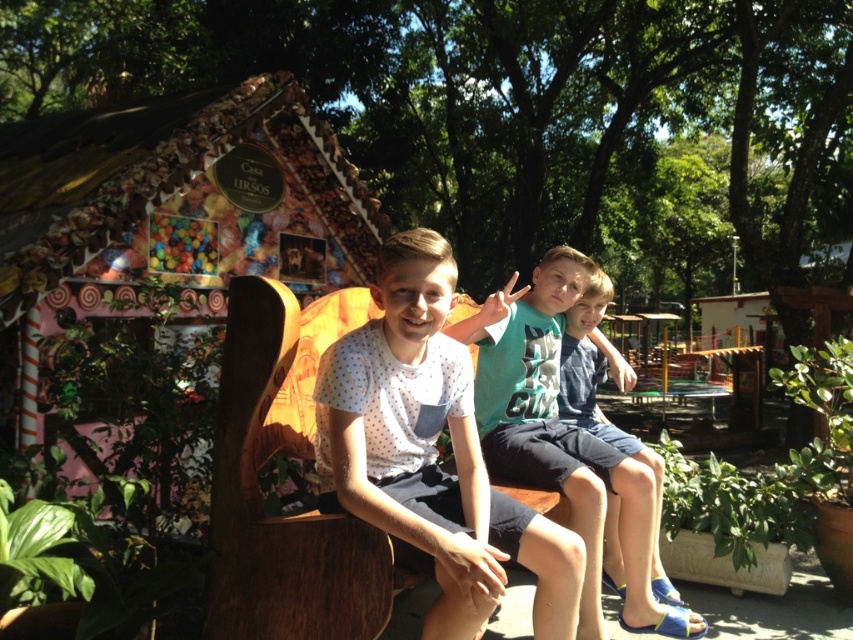
You are a photographer trying to capture a candid shot of the children. You want to ensure the white dotted shirt at center and the blue denim shorts at center are both in focus. Since the camera can only focus on one subject at a time, which one should you choose to ensure both are sharp?

The white dotted shirt at center is to the left of blue denim shorts at center, so focusing on the white dotted shirt at center will ensure both are in focus as they are positioned closely together.

You are standing in the park and see two points marked in the image. The first point is at coordinates point (457, 465) and the second is at point (682, 632). Which point is closer to your current position?

The point at coordinates point (457, 465) is closer to the camera than point (682, 632), so it is closer to your current position.